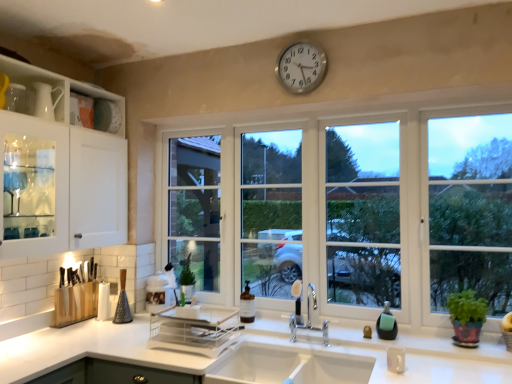
This screenshot has height=384, width=512. Describe the element at coordinates (467, 307) in the screenshot. I see `green leafy plant in pot at right` at that location.

Identify the location of silver metallic clock at upper center. This screenshot has width=512, height=384. (301, 67).

Find the location of a particular element. white glossy cabinet at left is located at coordinates (59, 167).

Image resolution: width=512 pixels, height=384 pixels. I want to click on translucent glass soap dispenser at sink, so click(x=247, y=305).

Considering the relative sizes of white glossy countertop at lower center and white glass window at center in the image provided, is white glossy countertop at lower center wider than white glass window at center?

Correct, the width of white glossy countertop at lower center exceeds that of white glass window at center.

This screenshot has width=512, height=384. Identify the location of window that appears above the white glossy countertop at lower center (from a real-world perspective). (347, 210).

Would you say white glossy countertop at lower center is inside or outside white glass window at center?

white glossy countertop at lower center is outside white glass window at center.

Which is more to the right, white glossy countertop at lower center or white glass window at center?

Positioned to the right is white glass window at center.

Which is closer, (241,299) or (324,377)?

Point (241,299).

Can you tell me how much translucent glass soap dispenser at sink and white ceramic sink at center differ in facing direction?

The angle between the facing direction of translucent glass soap dispenser at sink and the facing direction of white ceramic sink at center is 3.07 degrees.

Between translucent glass soap dispenser at sink and white ceramic sink at center, which one has smaller width?

Thinner between the two is translucent glass soap dispenser at sink.

Is translucent glass soap dispenser at sink far from white ceramic sink at center?

No, translucent glass soap dispenser at sink is not far away from white ceramic sink at center.

Does point (4, 190) appear closer or farther from the camera than point (298, 54)?

Point (4, 190) appears to be closer to the viewer than point (298, 54).

Based on the photo, can you confirm if white glossy cabinet at left is smaller than silver metallic clock at upper center?

No, white glossy cabinet at left is not smaller than silver metallic clock at upper center.

Considering the relative positions of white glossy cabinet at left and silver metallic clock at upper center in the image provided, is white glossy cabinet at left to the left or to the right of silver metallic clock at upper center?

In the image, white glossy cabinet at left appears on the left side of silver metallic clock at upper center.

How many degrees apart are the facing directions of white glossy cabinet at left and silver metallic clock at upper center?

The facing directions of white glossy cabinet at left and silver metallic clock at upper center are 91 degrees apart.

Between white glossy countertop at lower center and green leafy plant in pot at right, which one has smaller width?

Thinner between the two is green leafy plant in pot at right.

Is point (478, 354) closer or farther from the camera than point (459, 301)?

Point (478, 354) is positioned closer to the camera compared to point (459, 301).

At what (x,y) coordinates should I click in order to perform the action: click on countertop in front of the green leafy plant in pot at right. Please return your answer as a coordinate pair (x, y). Looking at the image, I should click on (397, 345).

Which object is further away from the camera, white glossy countertop at lower center or green leafy plant in pot at right?

green leafy plant in pot at right is behind.

Which is in front, green leafy plant in pot at right or white ceramic sink at center?

white ceramic sink at center is more forward.

Is green leafy plant in pot at right turned away from white ceramic sink at center?

green leafy plant in pot at right does not have its back to white ceramic sink at center.

From the image's perspective, would you say green leafy plant in pot at right is positioned over white ceramic sink at center?

Correct, green leafy plant in pot at right appears higher than white ceramic sink at center in the image.

Could white glass window at center be considered to be inside green leafy plant in pot at right?

Actually, white glass window at center is outside green leafy plant in pot at right.

Between green leafy plant in pot at right and white glass window at center, which one is positioned in front?

green leafy plant in pot at right.

Is green leafy plant in pot at right far from white glass window at center?

Yes, green leafy plant in pot at right is far from white glass window at center.

Between green leafy plant in pot at right and white glass window at center, which one has less height?

green leafy plant in pot at right.

Where is `countertop lying below the silver metallic clock at upper center (from the image's perspective)`? countertop lying below the silver metallic clock at upper center (from the image's perspective) is located at coordinates click(397, 345).

Looking at their sizes, would you say silver metallic clock at upper center is wider or thinner than white glossy countertop at lower center?

In the image, silver metallic clock at upper center appears to be more narrow than white glossy countertop at lower center.

From a real-world perspective, which object stands above the other?

silver metallic clock at upper center, from a real-world perspective.

Is silver metallic clock at upper center with white glossy countertop at lower center?

No, silver metallic clock at upper center is not making contact with white glossy countertop at lower center.

Locate an element on the screen. The image size is (512, 384). countertop below the white glass window at center (from the image's perspective) is located at coordinates click(397, 345).

I want to click on bottle on the left of the white ceramic sink at center, so point(247,305).

From the image, which object appears to be nearer to silver metallic clock at upper center, green leafy plant in pot at right or white glossy countertop at lower center?

green leafy plant in pot at right is positioned closer to the anchor silver metallic clock at upper center.

Considering their positions, is white glossy cabinet at left positioned closer to translucent glass soap dispenser at sink than silver metallic clock at upper center?

The object closer to translucent glass soap dispenser at sink is white glossy cabinet at left.

When comparing their distances from translucent glass soap dispenser at sink, does clear plastic tray at center or white glossy countertop at lower center seem further?

white glossy countertop at lower center.

Based on their spatial positions, is white glossy cabinet at left or clear plastic tray at center closer to white glossy countertop at lower center?

clear plastic tray at center lies closer to white glossy countertop at lower center than the other object.

When comparing their distances from translucent glass soap dispenser at sink, does white glass window at center or white glossy cabinet at left seem closer?

white glass window at center is closer to translucent glass soap dispenser at sink.

Which object lies nearer to the anchor point white glossy countertop at lower center, silver metallic clock at upper center or white ceramic sink at center?

white ceramic sink at center.

Looking at the image, which one is located closer to white ceramic sink at center, white glass window at center or white glossy countertop at lower center?

Among the two, white glossy countertop at lower center is located nearer to white ceramic sink at center.

Based on their spatial positions, is clear plastic tray at center or white glossy cabinet at left closer to white glossy countertop at lower center?

Based on the image, clear plastic tray at center appears to be nearer to white glossy countertop at lower center.

Identify the location of bottle between clear plastic tray at center and white glass window at center from left to right. (247, 305).

You are a GUI agent. You are given a task and a screenshot of the screen. Output one action in this format:
    pyautogui.click(x=<x>, y=<y>)
    Task: Click on the appliance between white glass window at center and white glossy countertop at lower center in the up-down direction
    
    Given the screenshot: What is the action you would take?
    pyautogui.click(x=194, y=329)

I want to click on sink between translucent glass soap dispenser at sink and green leafy plant in pot at right in the horizontal direction, so click(x=287, y=366).

Find the location of a particular element. The image size is (512, 384). sink between white glossy countertop at lower center and translucent glass soap dispenser at sink in the front-back direction is located at coordinates (287, 366).